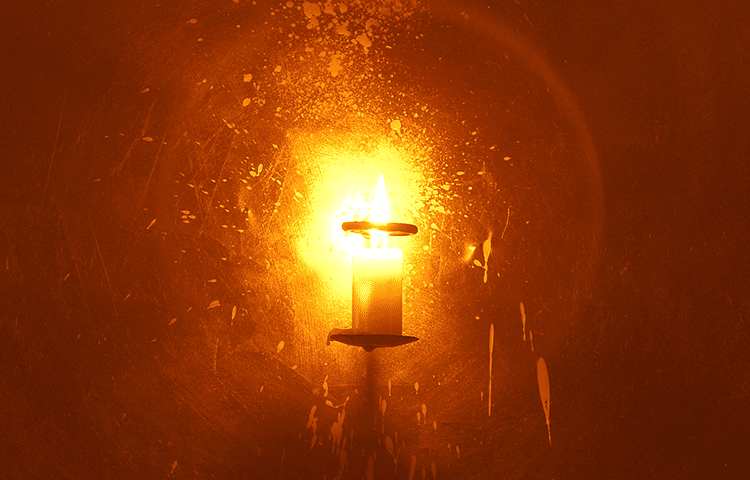
This screenshot has width=750, height=480. What are the coordinates of `top of the candle` in the screenshot? It's located at click(391, 252).